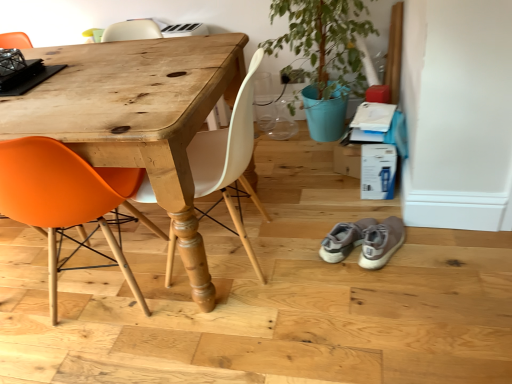
Question: Considering the positions of green matte potted plant at upper right and orange matte chair at left, which is the second chair in right-to-left order, in the image, is green matte potted plant at upper right taller or shorter than orange matte chair at left, which is the second chair in right-to-left order,?

Choices:
 (A) tall
 (B) short

Answer: (A)

Question: Considering the positions of green matte potted plant at upper right and orange matte chair at left, which is the 1th chair in left-to-right order, in the image, is green matte potted plant at upper right wider or thinner than orange matte chair at left, which is the 1th chair in left-to-right order,?

Choices:
 (A) wide
 (B) thin

Answer: (B)

Question: Which object is positioned closest to the matte white chair at center, the 2th chair viewed from the left?

Choices:
 (A) orange matte chair at left, which is the 1th chair in left-to-right order
 (B) green matte potted plant at upper right

Answer: (A)

Question: Which of these objects is positioned farthest from the matte white chair at center, the 2th chair viewed from the left?

Choices:
 (A) orange matte chair at left, which is the 1th chair in left-to-right order
 (B) green matte potted plant at upper right

Answer: (B)